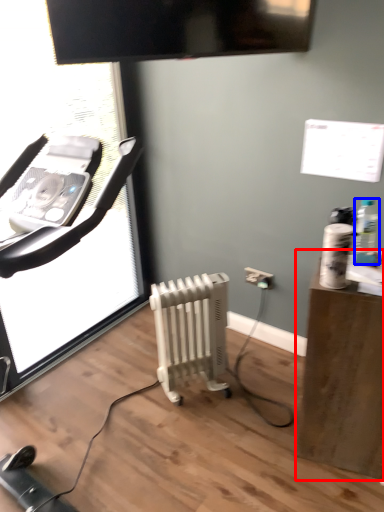
Question: Which point is further to the camera, furniture (highlighted by a red box) or bottle (highlighted by a blue box)?

Choices:
 (A) furniture
 (B) bottle

Answer: (B)